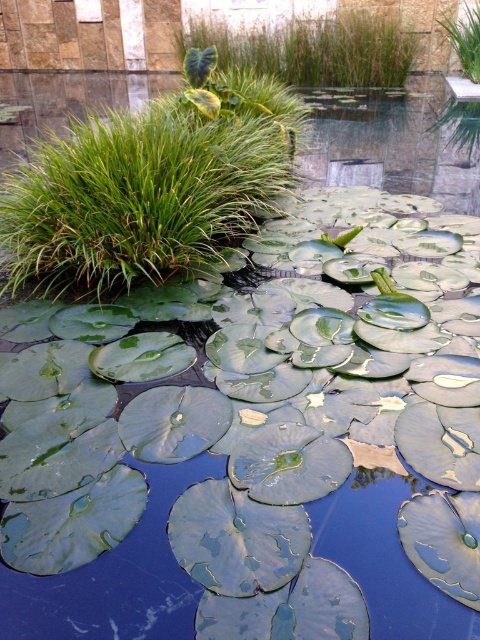
Does green leafy grass at upper left have a larger size compared to green leafy grass at upper center?

Incorrect, green leafy grass at upper left is not larger than green leafy grass at upper center.

Can you confirm if green leafy grass at upper left is smaller than green leafy grass at upper center?

Yes, green leafy grass at upper left is smaller than green leafy grass at upper center.

In order to click on green leafy grass at upper left in this screenshot , I will do `click(147, 188)`.

Locate an element on the screen. green leafy grass at upper left is located at coordinates (147, 188).

Is green leafy grass at upper left bigger than green glossy lily pad at upper center?

Actually, green leafy grass at upper left might be smaller than green glossy lily pad at upper center.

What do you see at coordinates (147, 188) in the screenshot?
I see `green leafy grass at upper left` at bounding box center [147, 188].

Locate an element on the screen. green leafy grass at upper left is located at coordinates (147, 188).

Is green leafy grass at upper center to the left of green glossy lily pad at upper center from the viewer's perspective?

Indeed, green leafy grass at upper center is positioned on the left side of green glossy lily pad at upper center.

Locate an element on the screen. green leafy grass at upper center is located at coordinates (312, 49).

Is point (305, 77) positioned after point (476, 112)?

That is True.

I want to click on green leafy grass at upper center, so click(x=312, y=49).